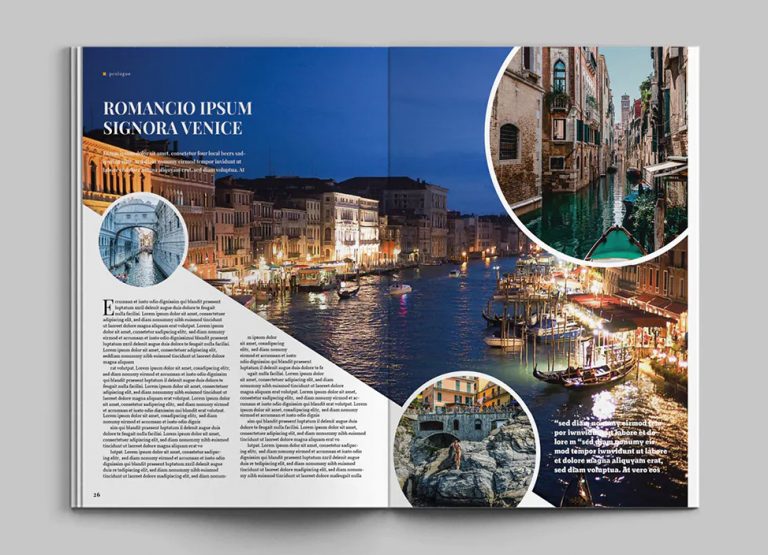
Where is `circular photo`? Image resolution: width=768 pixels, height=555 pixels. circular photo is located at coordinates (141, 250), (477, 444), (603, 166).